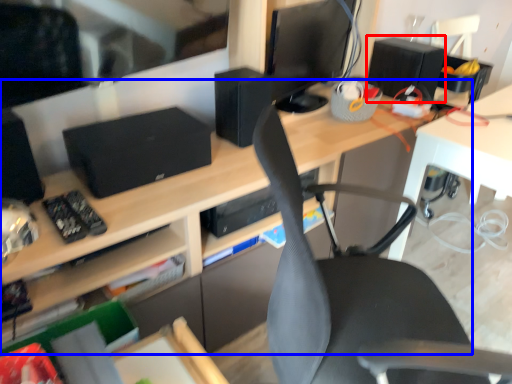
Question: Which object is closer to the camera taking this photo, speaker (highlighted by a red box) or desk (highlighted by a blue box)?

Choices:
 (A) speaker
 (B) desk

Answer: (B)